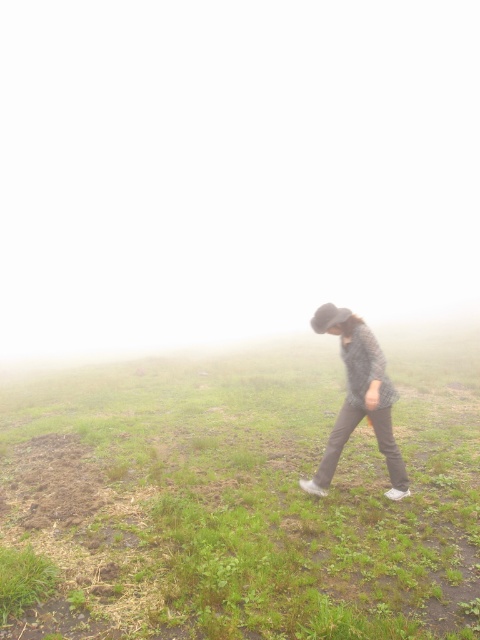
You are a hiker trying to cross the misty area. You see the green grassy at center and the plaid fabric shirt at center. Which object is closer to you as you approach the scene?

A: The green grassy at center is closer to you because it is positioned in front of the plaid fabric shirt at center.